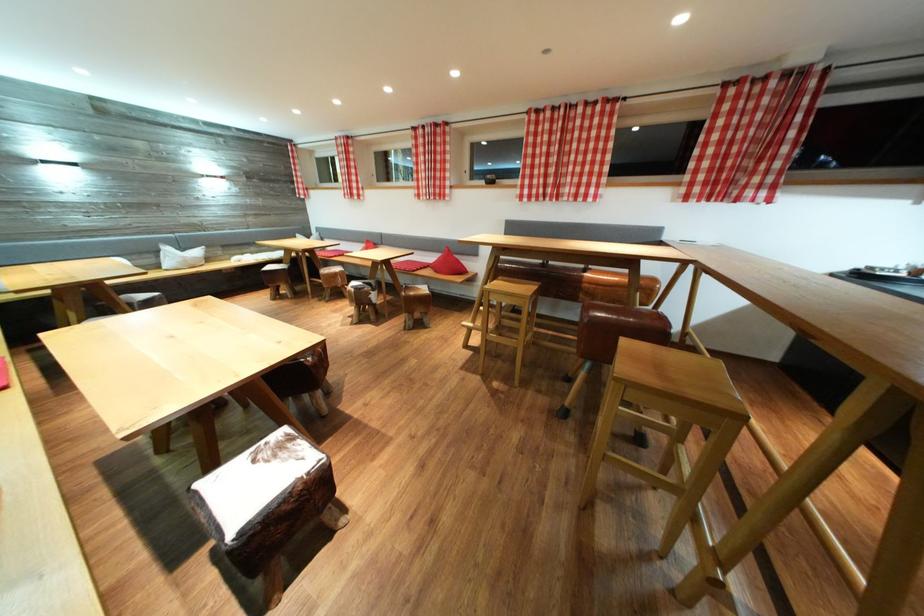
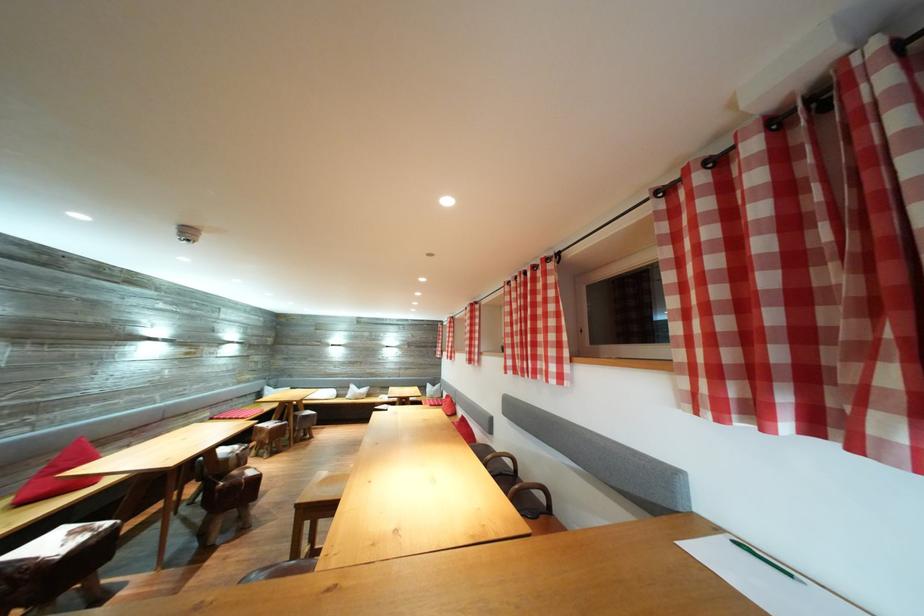
The point at (x=532, y=197) is marked in the first image. Where is the corresponding point in the second image?

(517, 368)